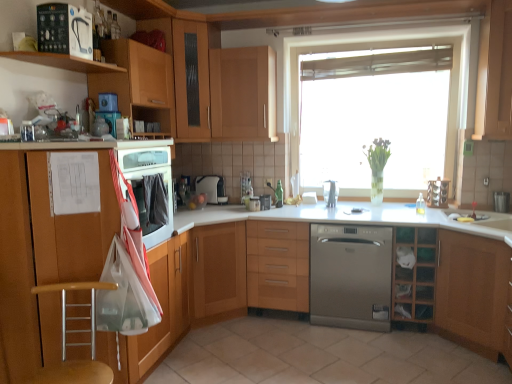
Identify the location of free space to the right of satin nickel faucet at center, the 1th appliance when ordered from right to left. The height and width of the screenshot is (384, 512). (350, 207).